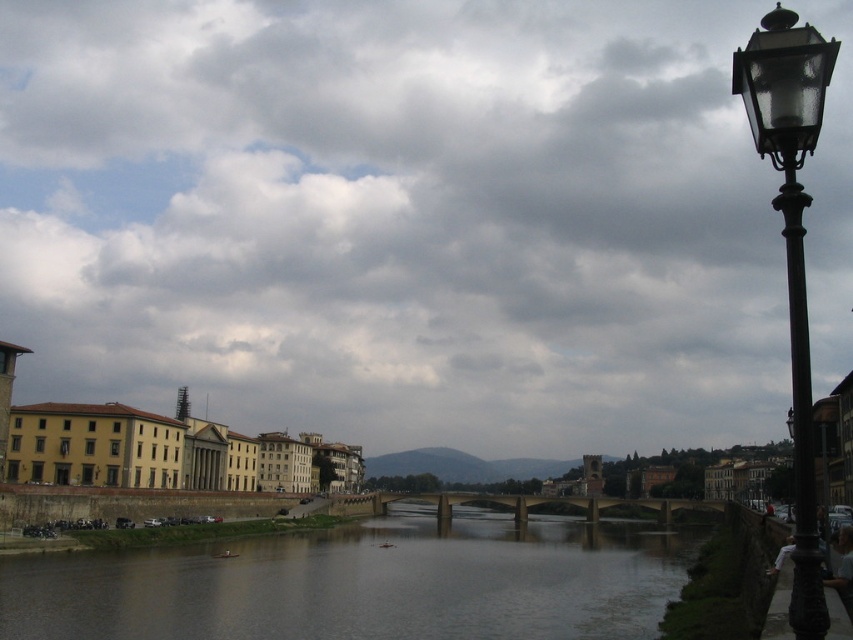
You are a photographer standing on the riverbank and want to capture the polished brass lamp post at right and the brown concrete river at center in your shot. Based on their positions, which object will appear closer to the camera in the photo?

The brown concrete river at center will appear closer to the camera because the polished brass lamp post at right is positioned behind it.

You are standing at the riverside and want to locate two specific points in the scene. The first point, point (x=300, y=532), is closer to you than the second point, point (x=801, y=102). Which point would you see first if you were to walk straight ahead from your current position?

You would see point (x=300, y=532) first because it is closer to you than point (x=801, y=102).

You are a photographer planning to capture the entire scene in one shot. Given that the brown concrete river at center and the polished brass lamp post at right are both in your frame, which object would require you to adjust your camera angle to include its full width?

The polished brass lamp post at right requires adjusting the camera angle because it has a greater width than the brown concrete river at center, as stated in the description.